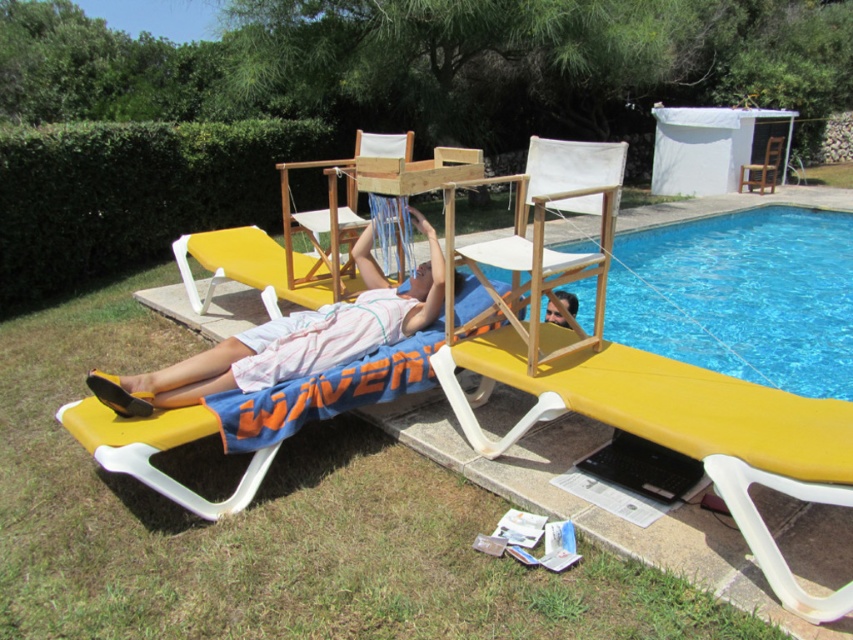
Question: Which point appears closest to the camera in this image?

Choices:
 (A) click(518, 291)
 (B) click(167, 497)
 (C) click(630, 236)

Answer: (B)

Question: Considering the relative positions of yellow plastic daybed at lower left and wooden weaving loom at center in the image provided, where is yellow plastic daybed at lower left located with respect to wooden weaving loom at center?

Choices:
 (A) right
 (B) left

Answer: (A)

Question: Is yellow plastic daybed at lower left to the right of yellow plastic beach chair at center from the viewer's perspective?

Choices:
 (A) no
 (B) yes

Answer: (B)

Question: Which object is farther from the camera taking this photo?

Choices:
 (A) wooden chair at upper right
 (B) wooden director's chair at upper center
 (C) wooden weaving loom at center
 (D) yellow plastic beach chair at center

Answer: (A)

Question: Is matte pink towel at lower left further to the viewer compared to wooden chair at upper right?

Choices:
 (A) no
 (B) yes

Answer: (A)

Question: Which object appears closest to the camera in this image?

Choices:
 (A) yellow plastic beach chair at center
 (B) wooden chair at upper right
 (C) yellow plastic daybed at lower left

Answer: (C)